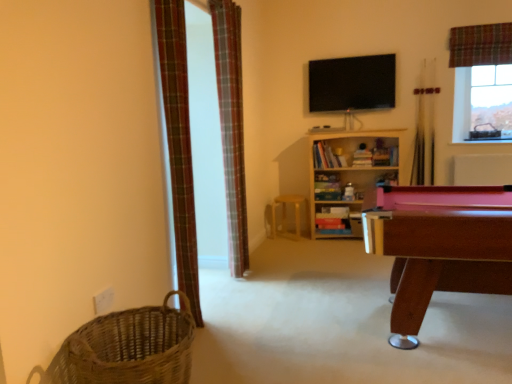
This screenshot has height=384, width=512. In order to click on plaid fabric curtain at upper right, the 3th curtain viewed from the left in this screenshot , I will do `click(480, 45)`.

The image size is (512, 384). What do you see at coordinates (480, 45) in the screenshot?
I see `plaid fabric curtain at upper right, placed as the 3th curtain when sorted from front to back` at bounding box center [480, 45].

Measure the distance between wooden bookshelf at center and camera.

The distance of wooden bookshelf at center from camera is 4.30 meters.

This screenshot has width=512, height=384. Describe the element at coordinates (179, 143) in the screenshot. I see `plaid fabric curtain at left, acting as the third curtain starting from the right` at that location.

The image size is (512, 384). In order to click on woven brown basket at lower left in this screenshot , I will do `click(128, 348)`.

This screenshot has height=384, width=512. What do you see at coordinates (231, 126) in the screenshot?
I see `plaid fabric curtain at center, marked as the second curtain in a back-to-front arrangement` at bounding box center [231, 126].

Find the location of `wooden pool table at right`. wooden pool table at right is located at coordinates (439, 246).

At what (x,y) coordinates should I click in order to perform the action: click on plaid fabric curtain at upper right, marked as the first curtain in a right-to-left arrangement. Please return your answer as a coordinate pair (x, y). The image size is (512, 384). Looking at the image, I should click on (480, 45).

Where is `basket on the left of the plaid fabric curtain at center, positioned as the 2th curtain in right-to-left order`? basket on the left of the plaid fabric curtain at center, positioned as the 2th curtain in right-to-left order is located at coordinates (128, 348).

Can you confirm if woven brown basket at lower left is positioned to the left of plaid fabric curtain at center, positioned as the 2th curtain in right-to-left order?

Indeed, woven brown basket at lower left is positioned on the left side of plaid fabric curtain at center, positioned as the 2th curtain in right-to-left order.

Can you confirm if woven brown basket at lower left is shorter than plaid fabric curtain at center, the second curtain when ordered from front to back?

Indeed, woven brown basket at lower left has a lesser height compared to plaid fabric curtain at center, the second curtain when ordered from front to back.

Which object is closer to the camera, plaid fabric curtain at left, which is the 3th curtain in back-to-front order, or plaid fabric curtain at upper right, the 3th curtain viewed from the left?

plaid fabric curtain at left, which is the 3th curtain in back-to-front order, is in front.

Is plaid fabric curtain at left, which is the 1th curtain in front-to-back order, taller than plaid fabric curtain at upper right, marked as the first curtain in a right-to-left arrangement?

Correct, plaid fabric curtain at left, which is the 1th curtain in front-to-back order, is much taller as plaid fabric curtain at upper right, marked as the first curtain in a right-to-left arrangement.

Is the position of plaid fabric curtain at center, marked as the second curtain in a back-to-front arrangement, less distant than that of plaid fabric curtain at upper right, which appears as the 1th curtain when viewed from the back?

Yes, it is.

Is plaid fabric curtain at center, marked as the second curtain in a back-to-front arrangement, completely or partially outside of plaid fabric curtain at upper right, the 3th curtain viewed from the left?

Yes, plaid fabric curtain at center, marked as the second curtain in a back-to-front arrangement, is located beyond the bounds of plaid fabric curtain at upper right, the 3th curtain viewed from the left.

Can you confirm if plaid fabric curtain at center, marked as the second curtain in a back-to-front arrangement, is shorter than plaid fabric curtain at upper right, placed as the 3th curtain when sorted from front to back?

Incorrect, the height of plaid fabric curtain at center, marked as the second curtain in a back-to-front arrangement, does not fall short of that of plaid fabric curtain at upper right, placed as the 3th curtain when sorted from front to back.

From the image's perspective, who appears lower, plaid fabric curtain at center, the 2th curtain viewed from the left, or plaid fabric curtain at upper right, the 3th curtain viewed from the left?

From the image's view, plaid fabric curtain at center, the 2th curtain viewed from the left, is below.

Considering the relative sizes of wooden pool table at right and plaid fabric curtain at upper right, marked as the first curtain in a right-to-left arrangement, in the image provided, is wooden pool table at right thinner than plaid fabric curtain at upper right, marked as the first curtain in a right-to-left arrangement,?

No.

Which object is positioned more to the left, wooden pool table at right or plaid fabric curtain at upper right, marked as the first curtain in a right-to-left arrangement?

From the viewer's perspective, wooden pool table at right appears more on the left side.

Considering the points (469, 285) and (469, 65), which point is behind, point (469, 285) or point (469, 65)?

Positioned behind is point (469, 65).

This screenshot has height=384, width=512. I want to click on curtain that is the 3rd object located above the wooden pool table at right (from the image's perspective), so click(x=480, y=45).

Considering the positions of point (151, 328) and point (175, 191), is point (151, 328) closer or farther from the camera than point (175, 191)?

Clearly, point (151, 328) is closer to the camera than point (175, 191).

Who is shorter, woven brown basket at lower left or plaid fabric curtain at left, acting as the third curtain starting from the right?

woven brown basket at lower left.

Is woven brown basket at lower left with plaid fabric curtain at left, which is the 1th curtain in front-to-back order?

No.

In terms of width, does plaid fabric curtain at upper right, the 3th curtain viewed from the left, look wider or thinner when compared to wooden stool at center?

Clearly, plaid fabric curtain at upper right, the 3th curtain viewed from the left, has less width compared to wooden stool at center.

From a real-world perspective, relative to wooden stool at center, is plaid fabric curtain at upper right, placed as the 3th curtain when sorted from front to back, vertically above or below?

In terms of real-world spatial position, plaid fabric curtain at upper right, placed as the 3th curtain when sorted from front to back, is above wooden stool at center.

Considering the sizes of plaid fabric curtain at upper right, which appears as the 1th curtain when viewed from the back, and wooden stool at center in the image, is plaid fabric curtain at upper right, which appears as the 1th curtain when viewed from the back, taller or shorter than wooden stool at center?

In the image, plaid fabric curtain at upper right, which appears as the 1th curtain when viewed from the back, appears to be taller than wooden stool at center.

Locate an element on the screen. curtain in front of the plaid fabric curtain at center, the 2th curtain viewed from the left is located at coordinates (179, 143).

From the image's perspective, would you say plaid fabric curtain at center, marked as the second curtain in a back-to-front arrangement, is shown under plaid fabric curtain at left, acting as the third curtain starting from the right?

No.

Can plaid fabric curtain at left, acting as the third curtain starting from the right, be found inside plaid fabric curtain at center, positioned as the 2th curtain in right-to-left order?

Definitely not — plaid fabric curtain at left, acting as the third curtain starting from the right, is not inside plaid fabric curtain at center, positioned as the 2th curtain in right-to-left order.

From a real-world perspective, relative to plaid fabric curtain at left, which is the 1th curtain in left-to-right order, is plaid fabric curtain at center, the 2th curtain viewed from the left, vertically above or below?

From a real-world perspective, plaid fabric curtain at center, the 2th curtain viewed from the left, is physically above plaid fabric curtain at left, which is the 1th curtain in left-to-right order.

In order to click on basket that is below the plaid fabric curtain at center, the second curtain when ordered from front to back (from the image's perspective) in this screenshot , I will do `click(128, 348)`.

Identify the location of the 2nd curtain directly beneath the plaid fabric curtain at upper right, placed as the 3th curtain when sorted from front to back (from a real-world perspective). The image size is (512, 384). (179, 143).

Looking at the image, which one is located closer to plaid fabric curtain at upper right, marked as the first curtain in a right-to-left arrangement, woven brown basket at lower left or plaid fabric curtain at center, the 2th curtain viewed from the left?

plaid fabric curtain at center, the 2th curtain viewed from the left, lies closer to plaid fabric curtain at upper right, marked as the first curtain in a right-to-left arrangement, than the other object.

When comparing their distances from plaid fabric curtain at upper right, placed as the 3th curtain when sorted from front to back, does plaid fabric curtain at left, which is the 3th curtain in back-to-front order, or wooden pool table at right seem further?

plaid fabric curtain at left, which is the 3th curtain in back-to-front order, is positioned further to the anchor plaid fabric curtain at upper right, placed as the 3th curtain when sorted from front to back.

From the image, which object appears to be farther from plaid fabric curtain at center, the 2th curtain viewed from the left, wooden pool table at right or wooden stool at center?

Based on the image, wooden pool table at right appears to be further to plaid fabric curtain at center, the 2th curtain viewed from the left.

Based on their spatial positions, is wooden stool at center or plaid fabric curtain at left, acting as the third curtain starting from the right, further from woven brown basket at lower left?

Among the two, wooden stool at center is located further to woven brown basket at lower left.

Based on their spatial positions, is plaid fabric curtain at center, the second curtain when ordered from front to back, or wooden pool table at right further from wooden bookshelf at center?

wooden pool table at right lies further to wooden bookshelf at center than the other object.

Estimate the real-world distances between objects in this image. Which object is closer to wooden bookshelf at center, wooden stool at center or plaid fabric curtain at left, acting as the third curtain starting from the right?

wooden stool at center is closer to wooden bookshelf at center.

Which object lies further to the anchor point plaid fabric curtain at upper right, the 3th curtain viewed from the left, plaid fabric curtain at left, which is the 1th curtain in left-to-right order, or woven brown basket at lower left?

woven brown basket at lower left is further to plaid fabric curtain at upper right, the 3th curtain viewed from the left.

When comparing their distances from wooden stool at center, does woven brown basket at lower left or wooden bookshelf at center seem further?

Based on the image, woven brown basket at lower left appears to be further to wooden stool at center.

I want to click on shelf located between wooden pool table at right and wooden stool at center in the depth direction, so click(349, 176).

The image size is (512, 384). I want to click on shelf between plaid fabric curtain at center, the 2th curtain viewed from the left, and wooden stool at center in the front-back direction, so click(349, 176).

The height and width of the screenshot is (384, 512). I want to click on shelf between woven brown basket at lower left and wooden stool at center along the z-axis, so click(x=349, y=176).

Find the location of a particular element. This screenshot has height=384, width=512. shelf located between plaid fabric curtain at left, which is the 1th curtain in front-to-back order, and plaid fabric curtain at upper right, which appears as the 1th curtain when viewed from the back, in the left-right direction is located at coordinates (349, 176).